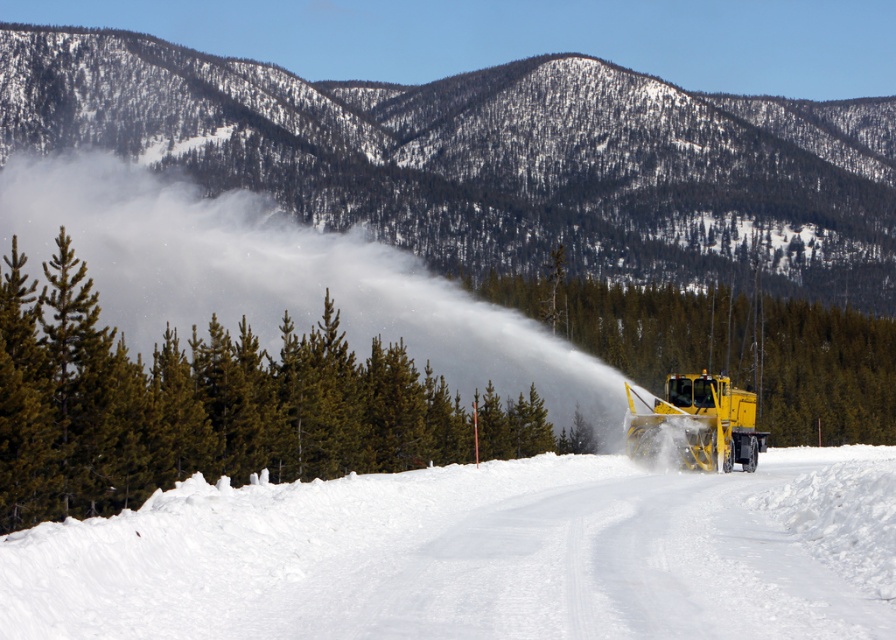
Question: Observing the image, what is the correct spatial positioning of green textured pine at center in reference to green matte tree at center?

Choices:
 (A) right
 (B) left

Answer: (B)

Question: Is snowy forested mountain at upper center further to the viewer compared to green textured pine at center?

Choices:
 (A) yes
 (B) no

Answer: (A)

Question: Which of the following is the closest to the observer?

Choices:
 (A) green matte tree at center
 (B) snowy forested mountain at upper center
 (C) green textured pine at center

Answer: (C)

Question: Does snowy forested mountain at upper center have a lesser width compared to green matte tree at center?

Choices:
 (A) no
 (B) yes

Answer: (A)

Question: Which is farther from the yellow metallic snowplow at center?

Choices:
 (A) green matte tree at center
 (B) white powdery snow at center
 (C) snowy forested mountain at upper center

Answer: (C)

Question: Estimate the real-world distances between objects in this image. Which object is closer to the snowy forested mountain at upper center?

Choices:
 (A) green textured pine at center
 (B) green matte tree at center
 (C) yellow metallic snowplow at center

Answer: (B)